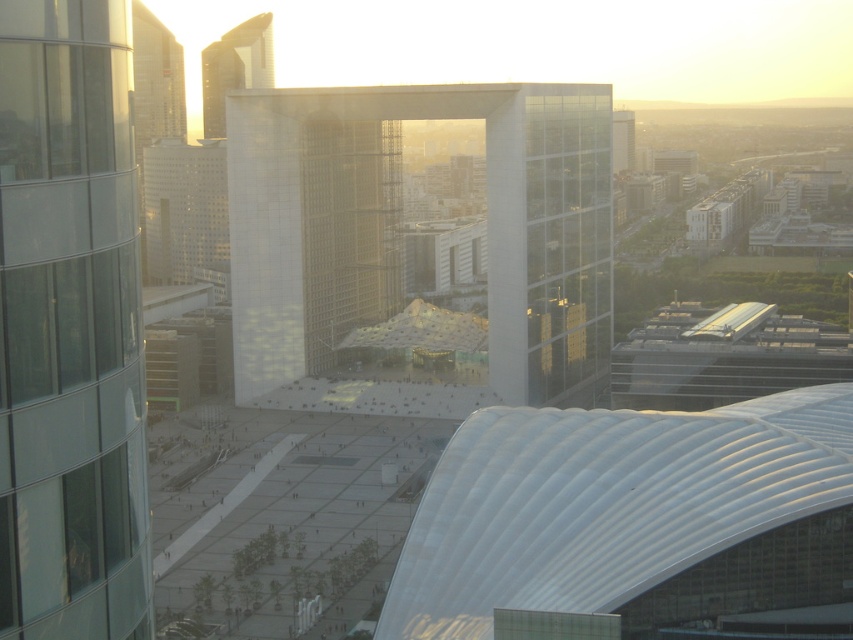
You are a drone operator who needs to fly a drone from the transparent glass building at center to the white glass building at upper center. According to the scene, which building is closer to you, and why?

The transparent glass building at center is closer to you because it is positioned in front of the white glass building at upper center, meaning you would reach it first before the white glass building at upper center.